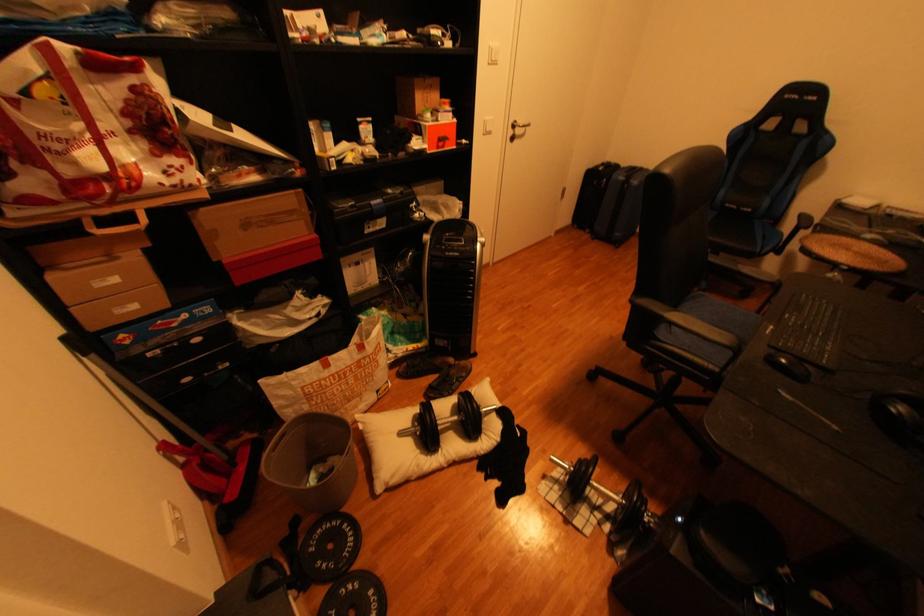
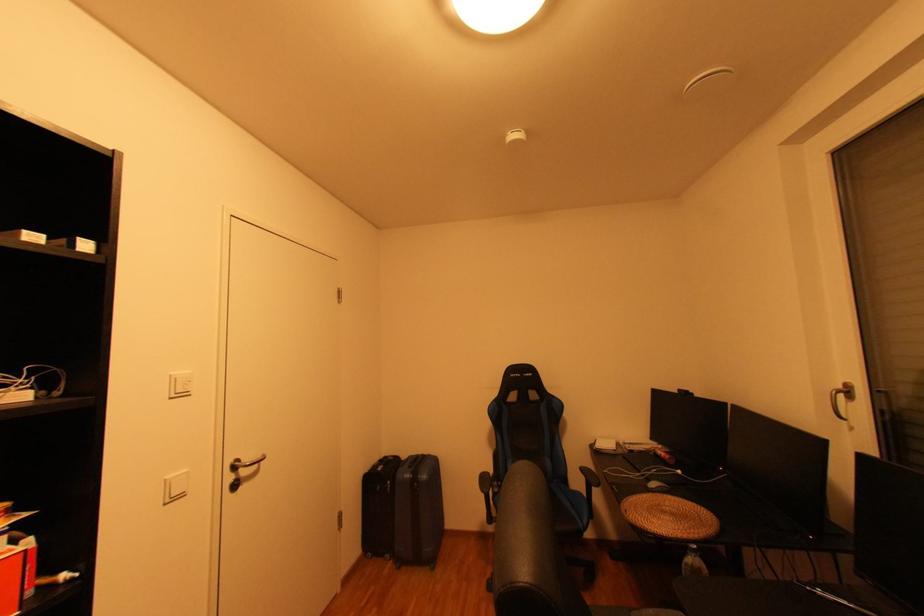
In the second image, find the point that corresponds to [599,235] in the first image.

(400, 562)